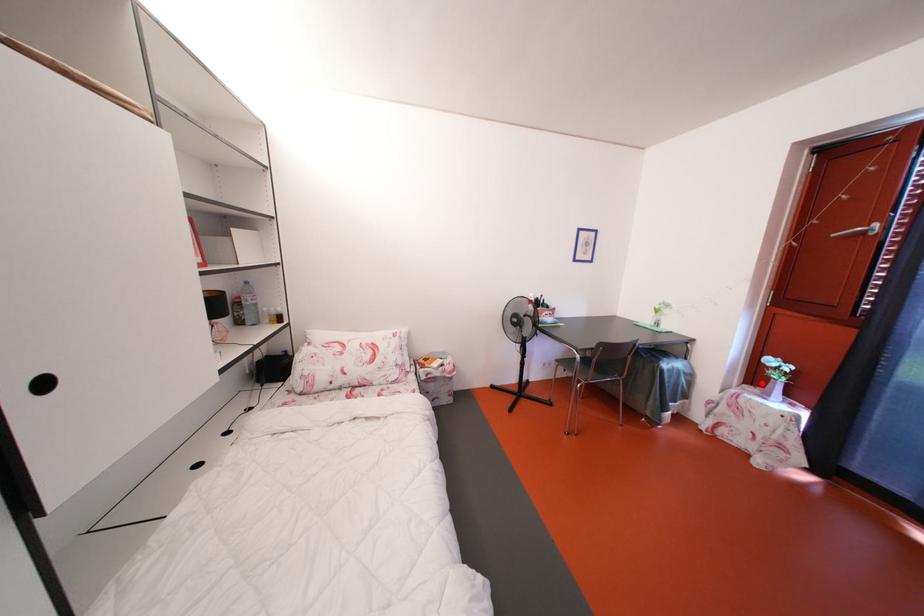
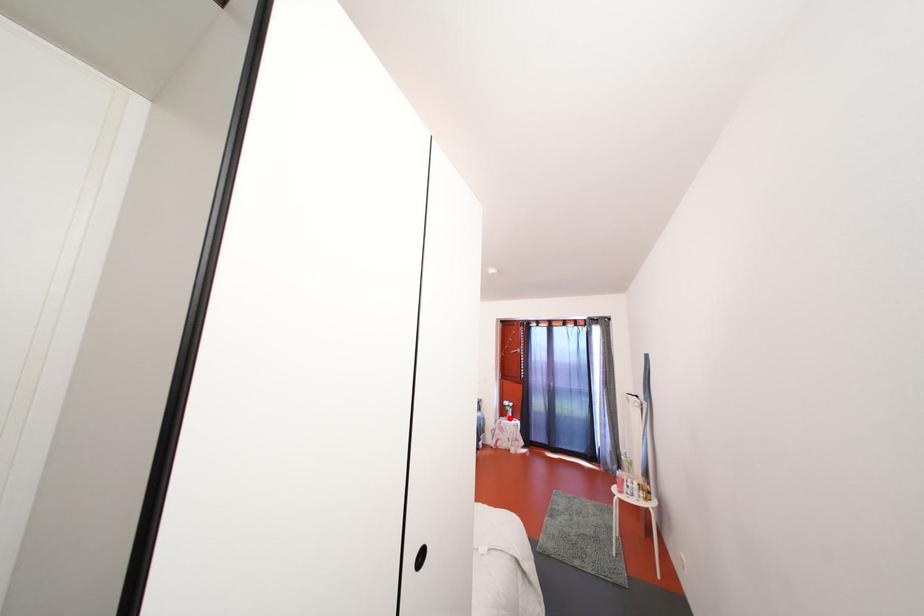
I am providing you with two images of the same scene from different viewpoints. A red point is marked on the first image and another point is marked on the second image. Do the highlighted points in image1 and image2 indicate the same real-world spot?

Yes